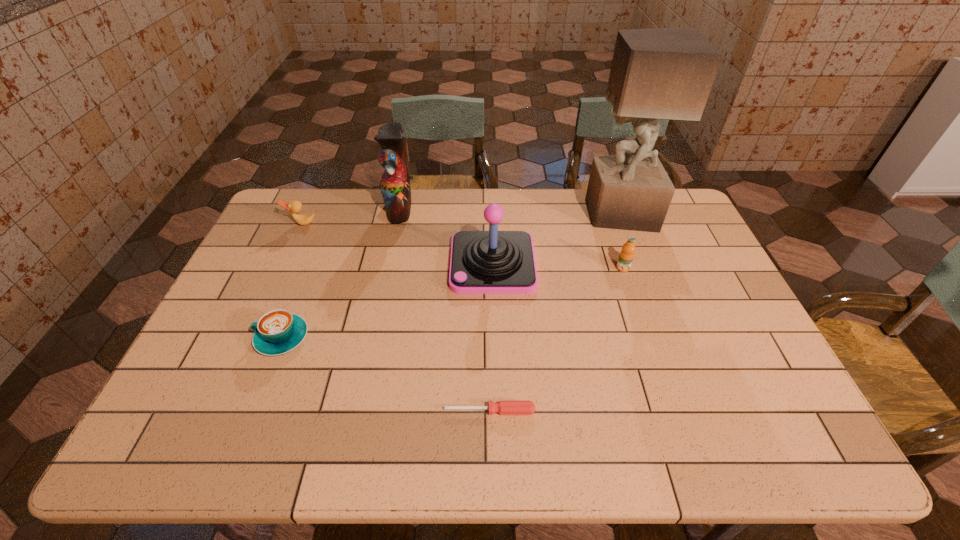
Find the location of a particular element. This screenshot has width=960, height=540. vacant point located 0.110m on the front-facing side of the tallest object is located at coordinates (555, 213).

I want to click on blank area located 0.270m on the front-facing side of the tallest object, so click(x=511, y=213).

Where is `vacant space located 0.050m on the front-facing side of the tallest object`? The image size is (960, 540). vacant space located 0.050m on the front-facing side of the tallest object is located at coordinates (572, 213).

Image resolution: width=960 pixels, height=540 pixels. Identify the location of vacant area located at the face of the third object from left to right. (448, 207).

In order to click on free space located 0.340m forward from the base of the third tallest object in this screenshot , I will do `click(343, 264)`.

Identify the location of vacant space located forward from the base of the third tallest object. The height and width of the screenshot is (540, 960). (406, 264).

What are the coordinates of `blank space located 0.300m forward from the base of the third tallest object` in the screenshot? It's located at 356,264.

Where is `vacant position located on the label of the fourth shortest object`? This screenshot has width=960, height=540. vacant position located on the label of the fourth shortest object is located at coordinates (634, 302).

Locate an element on the screen. The image size is (960, 540). free location located on the beak of the duck is located at coordinates (271, 291).

The height and width of the screenshot is (540, 960). Find the location of `vacant space located 0.060m with the handle on the right side of the second shortest object`. vacant space located 0.060m with the handle on the right side of the second shortest object is located at coordinates (234, 338).